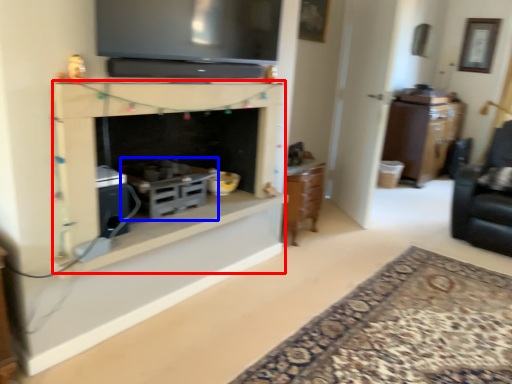
Question: Which of the following is the closest to the observer, fireplace (highlighted by a red box) or appliance (highlighted by a blue box)?

Choices:
 (A) fireplace
 (B) appliance

Answer: (A)